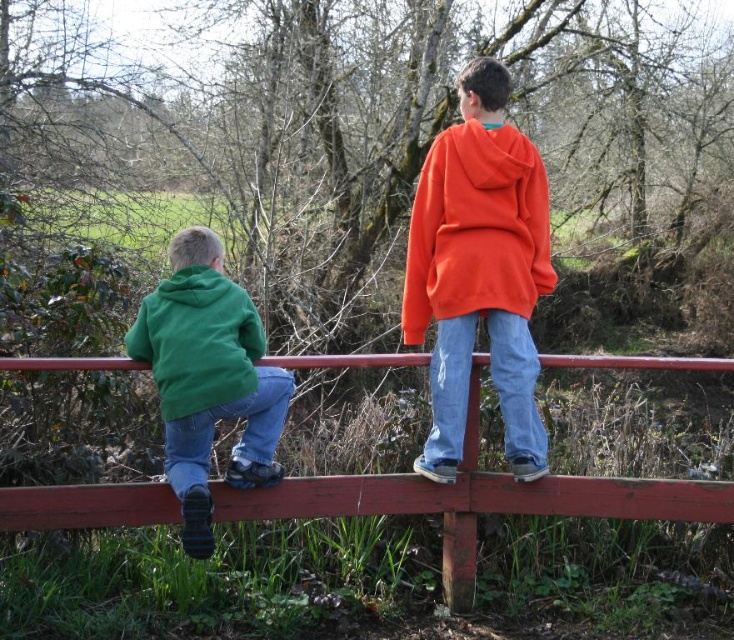
You are a photographer standing in front of the smooth wooden fence at center and the green fleece sweatshirt at left. Which object is closer to you?

The green fleece sweatshirt at left is closer to you because the smooth wooden fence at center is further away.

You are a photographer trying to capture a shot of the orange fleece jacket at upper center and the green fleece sweatshirt at left. Which one is located more to the right in the image?

The orange fleece jacket at upper center is more to the right than the green fleece sweatshirt at left.

You are a photographer trying to capture a photo of the smooth wooden fence at center and the green fleece sweatshirt at left. Based on their positions, which object should you adjust your camera to focus on first if you want to include both in the frame?

The green fleece sweatshirt at left should be focused on first because the smooth wooden fence at center is positioned to its right, meaning the sweatshirt is closer to the camera and requires initial framing to ensure both fit in the shot.